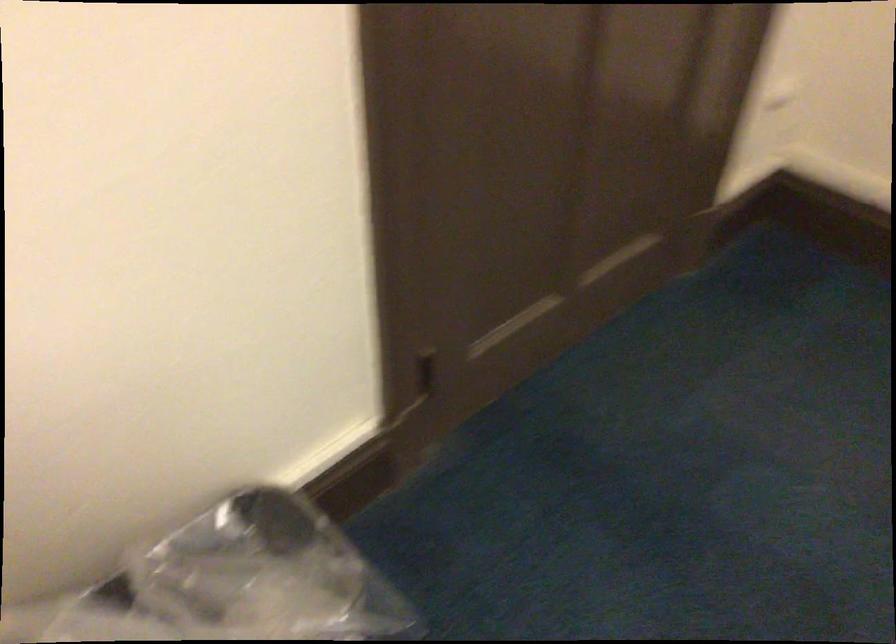
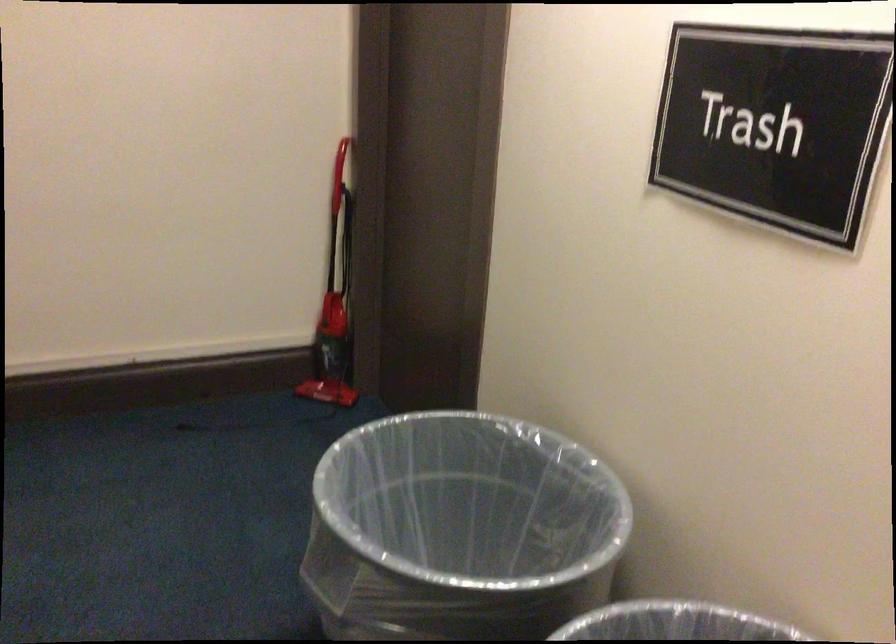
Question: How did the camera likely rotate?

Choices:
 (A) Left
 (B) Right
 (C) Up
 (D) Down

Answer: (B)